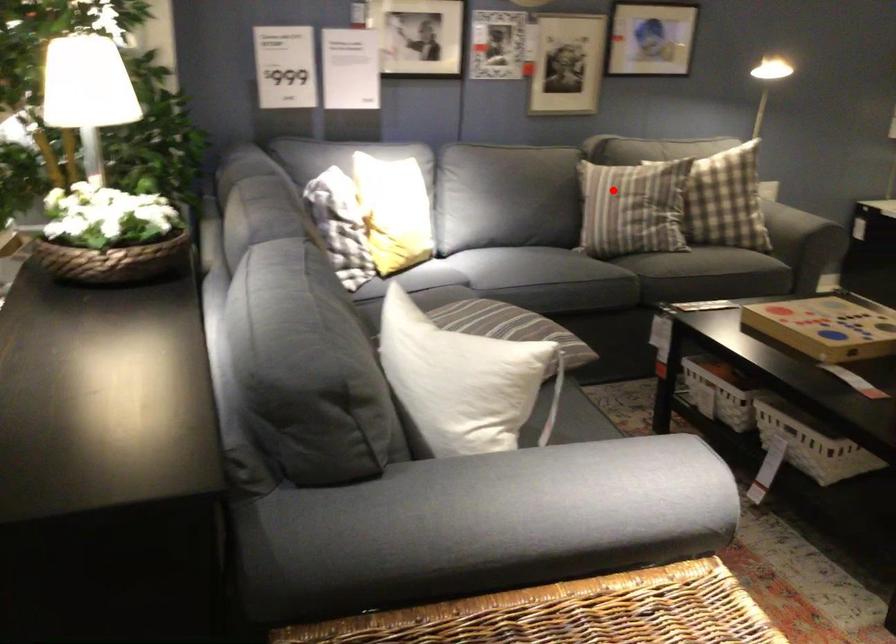
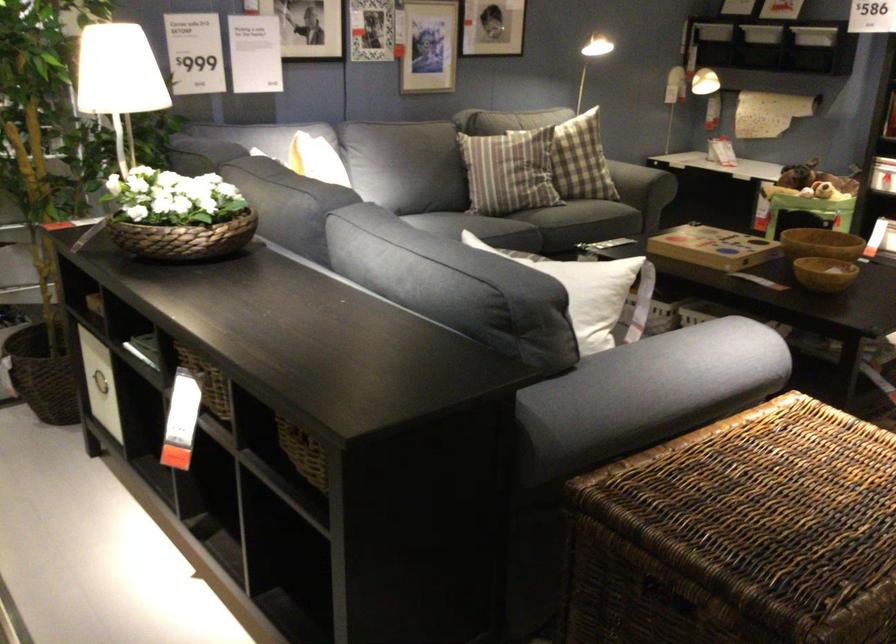
Question: I am providing you with two images of the same scene from different viewpoints. Image1 has a red point marked. In image2, the corresponding 3D location appears at what relative position? Reply with the corresponding letter.

Choices:
 (A) Closer
 (B) Farther

Answer: (B)